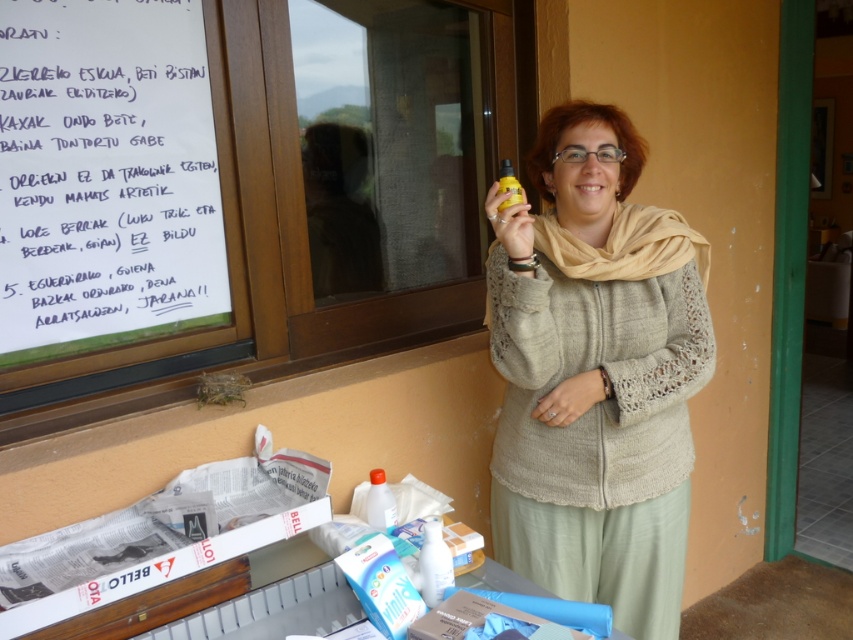
You are a delivery person who needs to place a new package on the table. The package is 10 cm thick. There are two bottles on the table. The yellow matte bottle at upper center and the translucent plastic bottle at lower center. Which bottle should you move to make space for the package?

You should move the translucent plastic bottle at lower center because the yellow matte bottle at upper center is behind it, so moving the translucent plastic bottle at lower center will create space in front for the package.

Based on the scene description, can you determine which object is covering the other between the knitted beige sweater at center and the translucent plastic bottle at lower center?

The knitted beige sweater at center is positioned over the translucent plastic bottle at lower center, so the sweater is covering the bottle.

You are a fashion designer observing the woman in the scene. You need to determine the spatial relationship between the knitted beige sweater at center and the yellow matte bottle at upper center. Which object is positioned closer to you?

The knitted beige sweater at center is closer to the viewer than the yellow matte bottle at upper center.